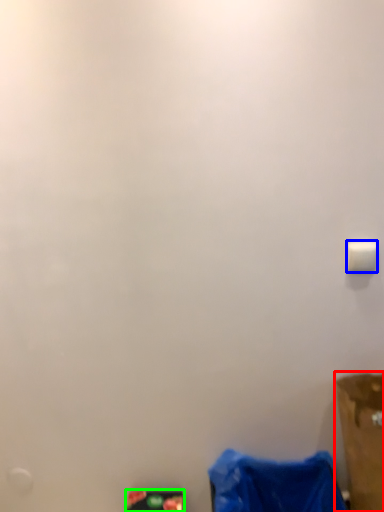
Question: Which object is the farthest from furniture (highlighted by a red box)? Choose among these: light switch (highlighted by a blue box) or waste (highlighted by a green box).

Choices:
 (A) light switch
 (B) waste

Answer: (B)